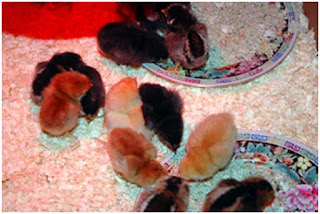
The width and height of the screenshot is (320, 214). Identify the location of plate. (233, 70), (297, 158).